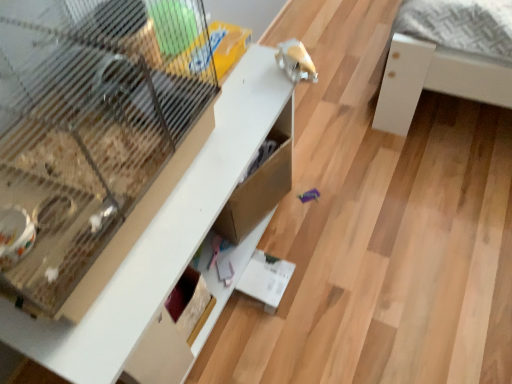
What do you see at coordinates (164, 238) in the screenshot? The width and height of the screenshot is (512, 384). I see `white cardboard box at upper left` at bounding box center [164, 238].

The width and height of the screenshot is (512, 384). I want to click on white cardboard box at upper left, so click(164, 238).

Find the location of a particular element. The width and height of the screenshot is (512, 384). white cardboard box at upper left is located at coordinates (164, 238).